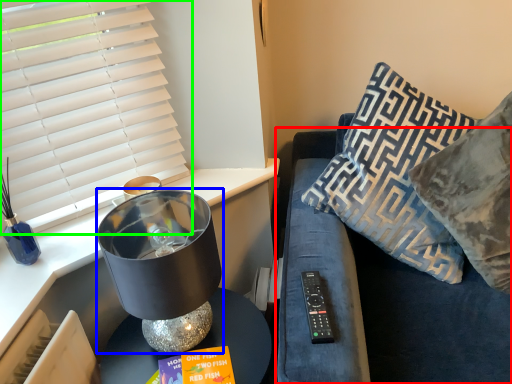
Question: Considering the real-world distances, which object is closest to couch (highlighted by a red box)? table lamp (highlighted by a blue box) or window blind (highlighted by a green box).

Choices:
 (A) table lamp
 (B) window blind

Answer: (A)